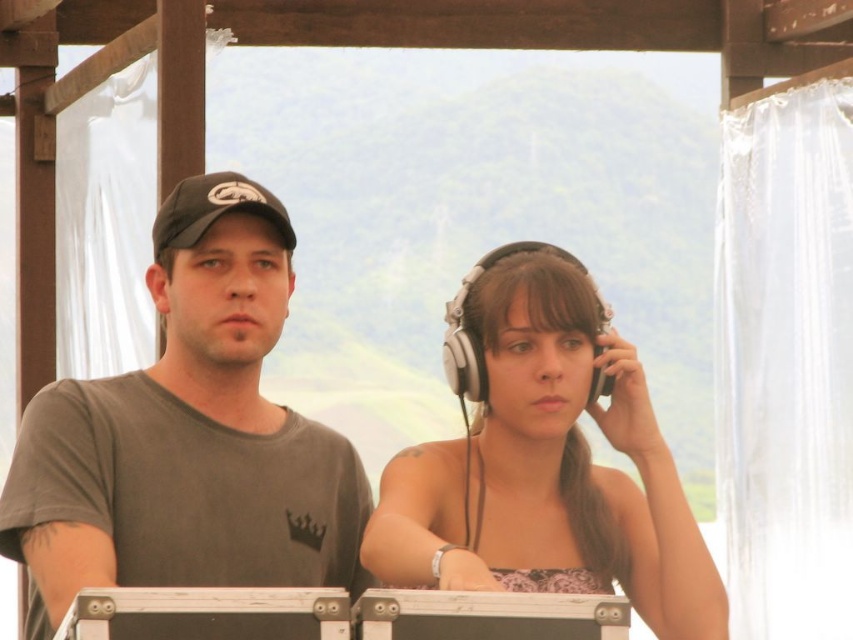
You are standing in front of the wooden structure and want to place a small flower pot between the two points marked as point (305, 534) and point (387, 474). Which point should the flower pot be closer to in order to be closer to the camera?

The flower pot should be closer to point (305, 534) because it is further to the camera than point (387, 474).

Which object is located at the coordinates point (189, 435)?

The gray matte t shirt at center is located at point (189, 435).